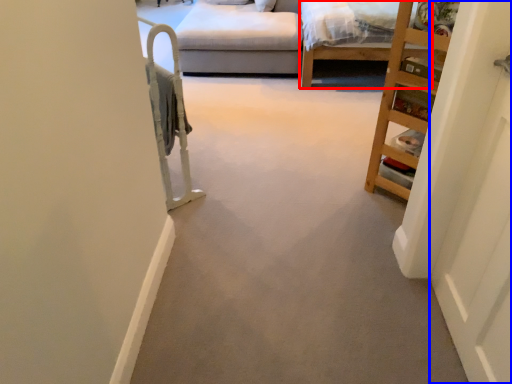
Question: Which point is closer to the camera, bed frame (highlighted by a red box) or door (highlighted by a blue box)?

Choices:
 (A) bed frame
 (B) door

Answer: (B)